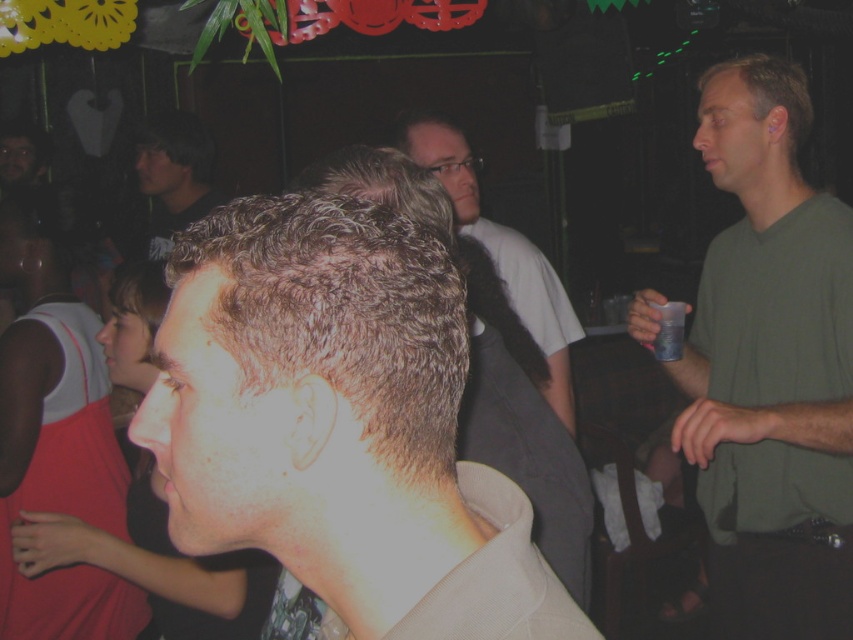
You are at the party and want to find the green matte shirt at right. According to the coordinates provided, where should you look in the image?

The green matte shirt at right is located at the 2D coordinates point (770, 365) in the image.

You are at a party and want to find the person with the green matte shirt at right. Which direction should you look relative to the person with dark brown hair at upper left?

The green matte shirt at right is located to the right of the dark brown hair at upper left, so you should look to the right of the dark brown hair at upper left to find the green matte shirt at right.